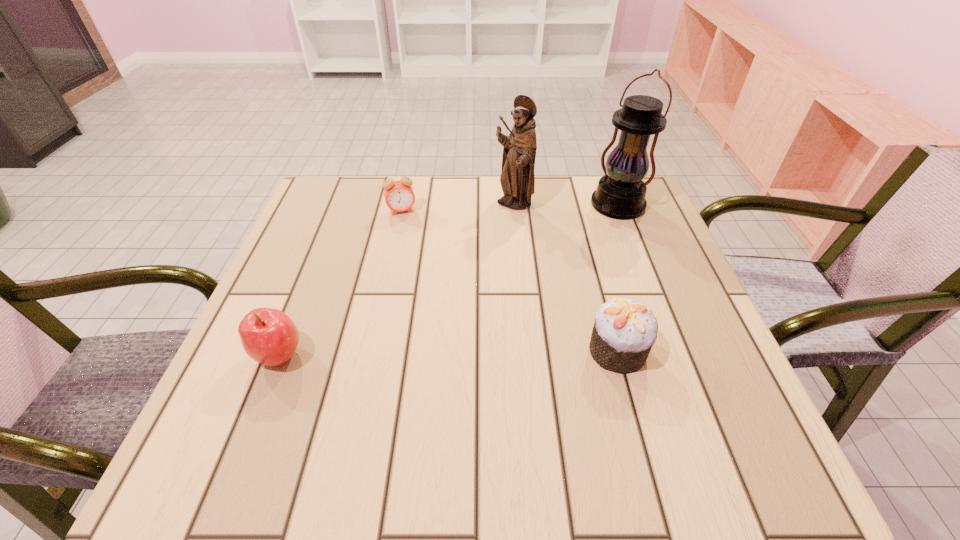
You are a GUI agent. You are given a task and a screenshot of the screen. Output one action in this format:
    pyautogui.click(x=<x>, y=<y>)
    Task: Click on the vacant space at the left edge of the desktop
    Image resolution: width=960 pixels, height=540 pixels.
    Given the screenshot: What is the action you would take?
    pyautogui.click(x=314, y=350)

In the image, there is a desktop. Where is `vacant space at the right edge`? vacant space at the right edge is located at coordinates (646, 288).

Find the location of a particular element. blank area at the far left corner is located at coordinates (365, 215).

In the image, there is a desktop. Where is `vacant region at the near left corner`? The width and height of the screenshot is (960, 540). vacant region at the near left corner is located at coordinates (309, 387).

I want to click on unoccupied position between the apple and the fourth shortest object, so click(x=396, y=280).

Identify the location of vacant area that lies between the fourth shortest object and the apple. 396,280.

I want to click on free spot between the alarm clock and the leftmost object, so click(x=341, y=283).

I want to click on vacant area that lies between the alarm clock and the cupcake, so click(510, 281).

At what (x,y) coordinates should I click in order to perform the action: click on vacant region between the apple and the third object from right to left. Please return your answer as a coordinate pair (x, y). The width and height of the screenshot is (960, 540). Looking at the image, I should click on (396, 280).

Find the location of `free space between the third object from right to left and the apple`. free space between the third object from right to left and the apple is located at coordinates (396, 280).